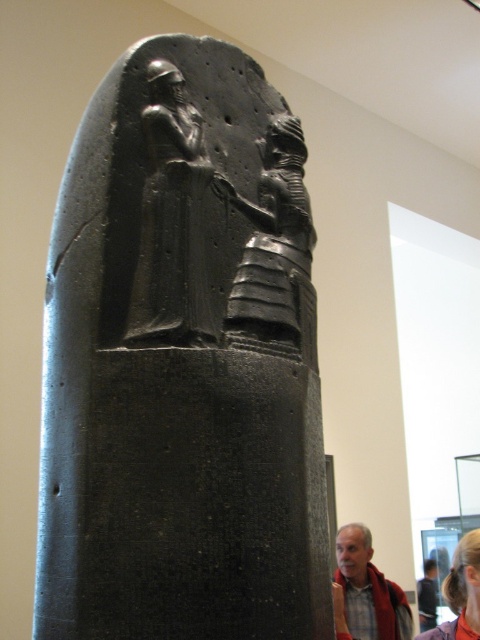
Question: Which of the following is the closest to the observer?

Choices:
 (A) gray fabric jacket at lower right
 (B) black stone figure at center

Answer: (B)

Question: Which point is closer to the camera?

Choices:
 (A) (250, 344)
 (B) (197, 433)

Answer: (B)

Question: Is black stone figure at center smaller than blonde hair at lower right?

Choices:
 (A) no
 (B) yes

Answer: (B)

Question: Does gray fabric jacket at lower right appear over blonde hair at lower right?

Choices:
 (A) no
 (B) yes

Answer: (A)

Question: Does black stone stele at center appear on the left side of blonde hair at lower right?

Choices:
 (A) yes
 (B) no

Answer: (A)

Question: Considering the real-world distances, which object is closest to the gray fabric jacket at lower right?

Choices:
 (A) blonde hair at lower right
 (B) black stone figure at center

Answer: (A)